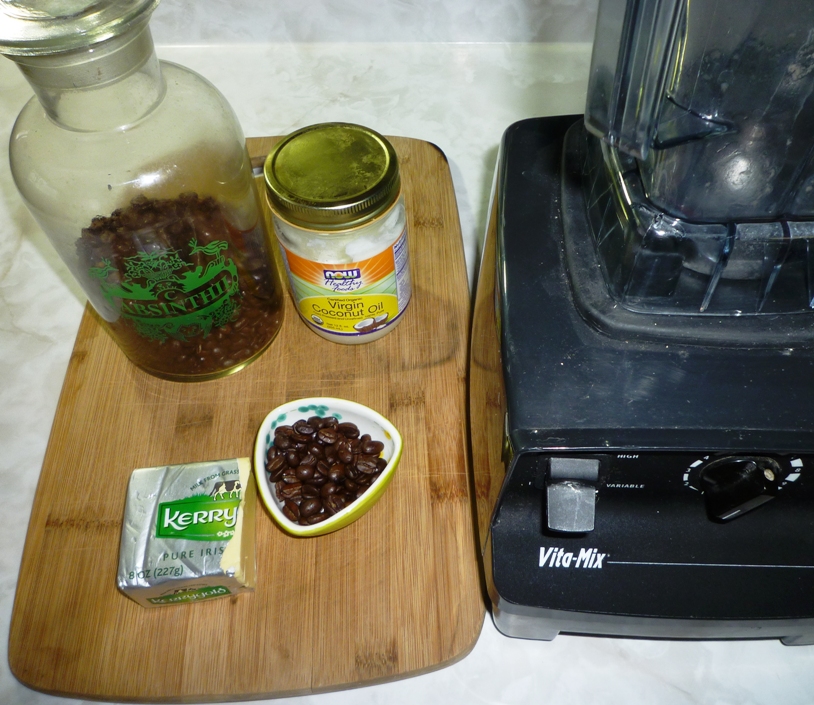
You are a GUI agent. You are given a task and a screenshot of the screen. Output one action in this format:
    pyautogui.click(x=<x>, y=<y>)
    Task: Click on the glass
    This screenshot has height=705, width=814.
    Given the screenshot: What is the action you would take?
    pyautogui.click(x=173, y=319)